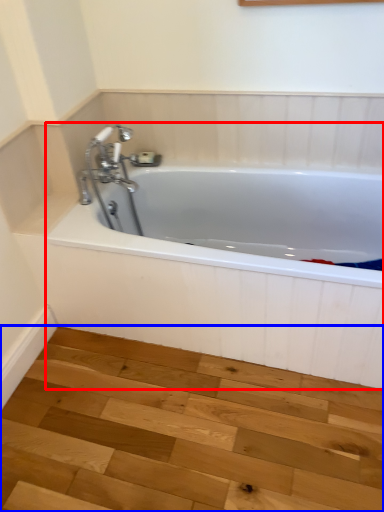
Question: Which object is further to the camera taking this photo, bathtub (highlighted by a red box) or stair (highlighted by a blue box)?

Choices:
 (A) bathtub
 (B) stair

Answer: (A)